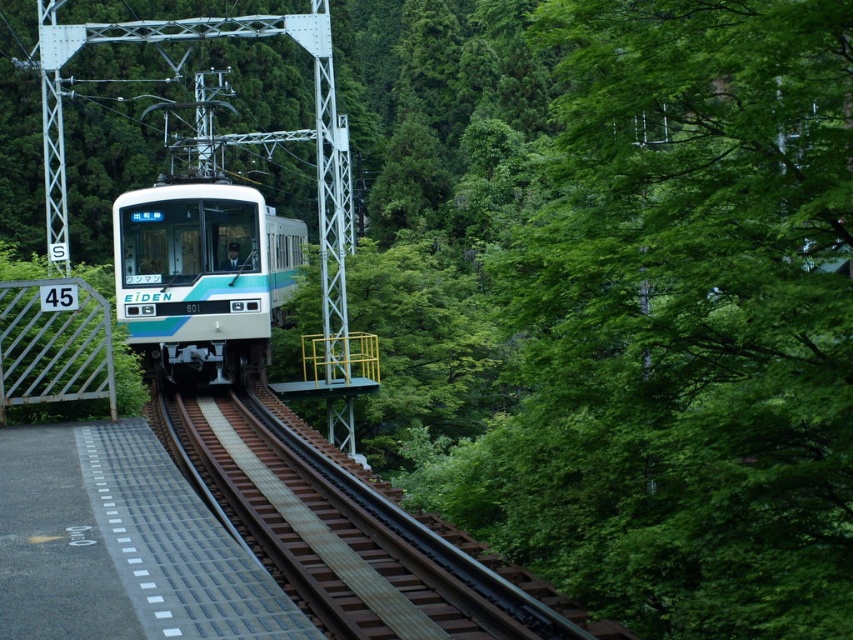
Question: Does brown wooden train track at center have a greater width compared to teal glossy train at center?

Choices:
 (A) yes
 (B) no

Answer: (A)

Question: Which point is closer to the camera?

Choices:
 (A) (192, 364)
 (B) (376, 586)

Answer: (B)

Question: From the image, what is the correct spatial relationship of brown wooden train track at center in relation to teal glossy train at center?

Choices:
 (A) above
 (B) below

Answer: (B)

Question: Is brown wooden train track at center above teal glossy train at center?

Choices:
 (A) no
 (B) yes

Answer: (A)